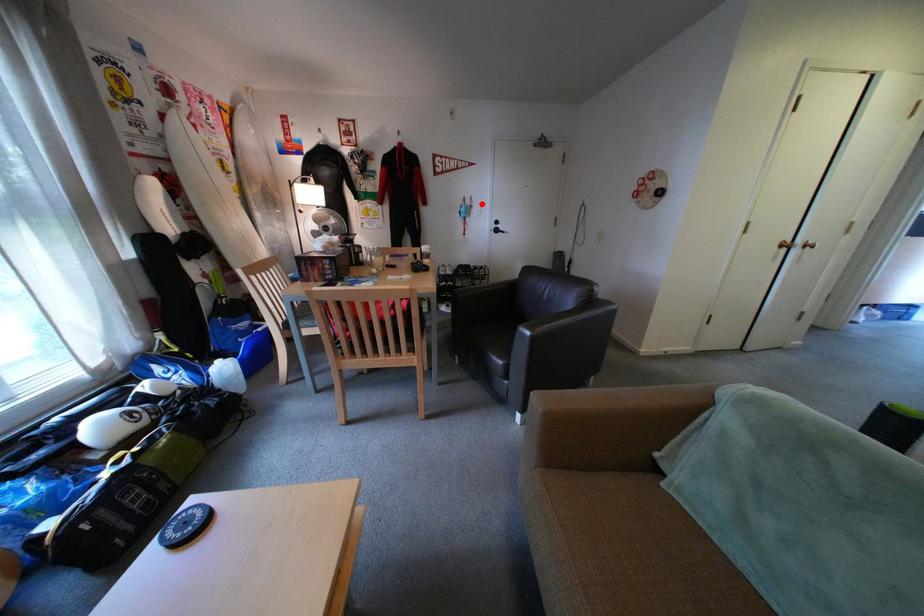
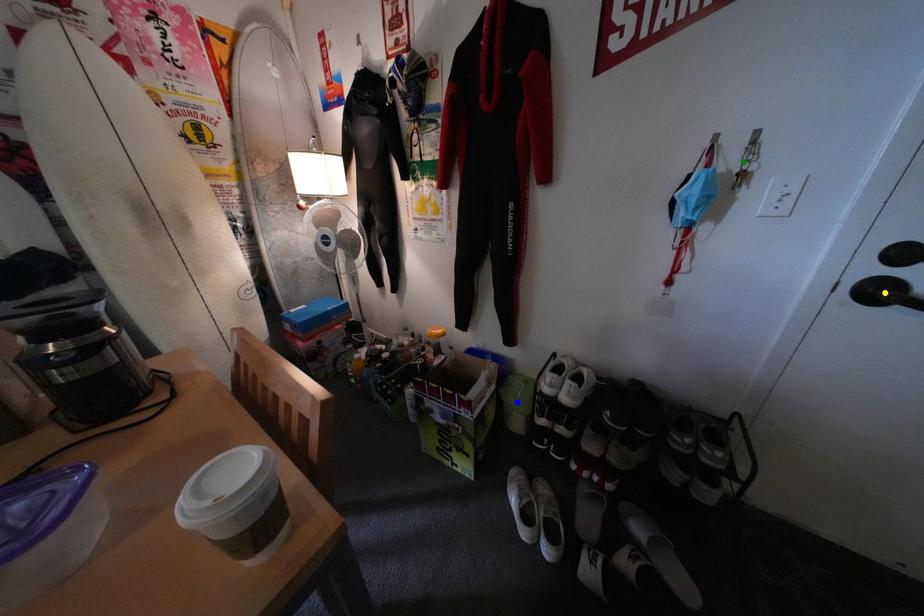
Question: I am providing you with two images of the same scene from different viewpoints. A red point is marked on the first image. You are given multiple points on the second image. Which spot in image 2 lines up with the point in image 1?

Choices:
 (A) green point
 (B) blue point
 (C) yellow point

Answer: (A)